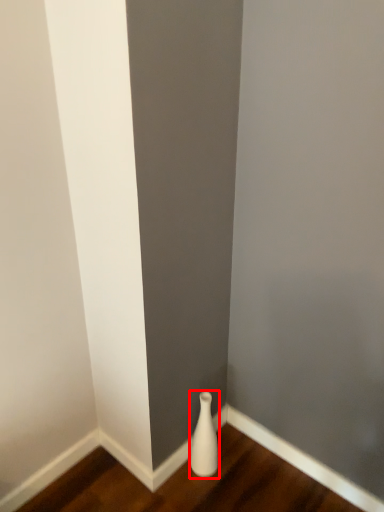
Question: In this image, where is vase (annotated by the red box) located relative to hardwood?

Choices:
 (A) right
 (B) left

Answer: (A)